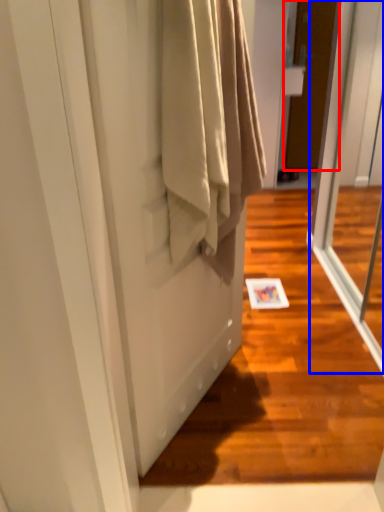
Question: Which point is further to the camera, door (highlighted by a red box) or screen door (highlighted by a blue box)?

Choices:
 (A) door
 (B) screen door

Answer: (A)